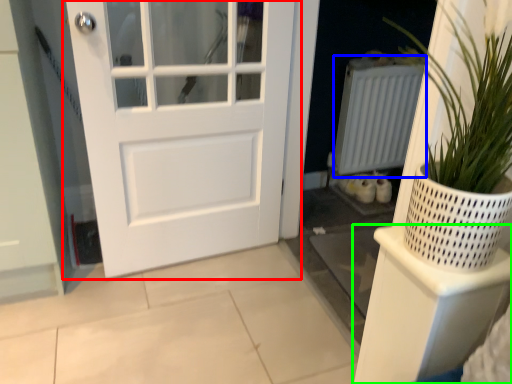
Question: Which is farther away from door (highlighted by a red box)? radiator (highlighted by a blue box) or shelf (highlighted by a green box)?

Choices:
 (A) radiator
 (B) shelf

Answer: (B)